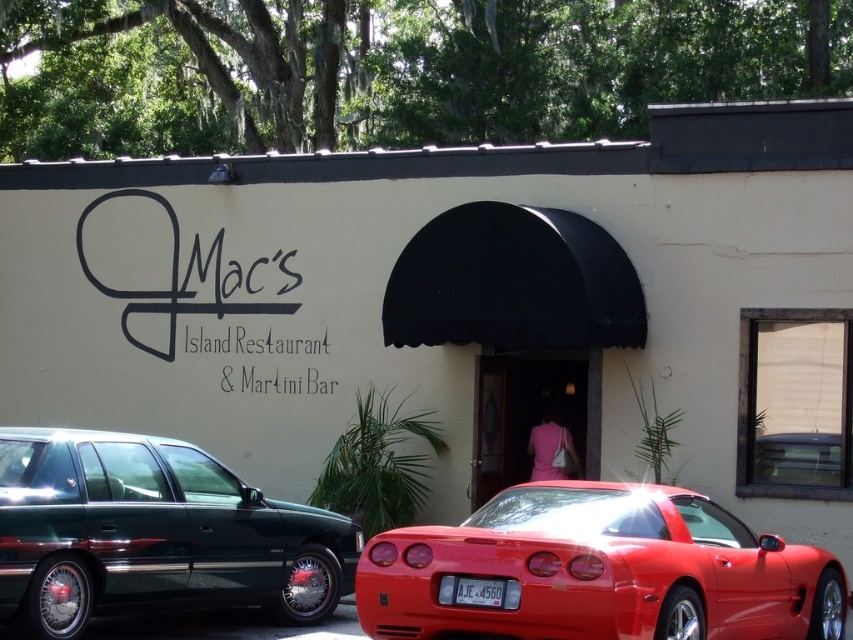
You are standing in front of Macs Island Restaurant Martini Bar and see the shiny red sports car at lower right and the shiny dark green sedan at left. Which car is positioned more to the right side of the scene?

The shiny red sports car at lower right is positioned more to the right side of the scene compared to the shiny dark green sedan at left.

You are a delivery driver who needs to park your truck next to the shiny dark green sedan at left and the white plastic license plate at center. Can you tell me which one you should park closer to if you want to avoid blocking the license plate?

The shiny dark green sedan at left is larger in size than the white plastic license plate at center, so you should park closer to the shiny dark green sedan at left to avoid blocking the license plate.